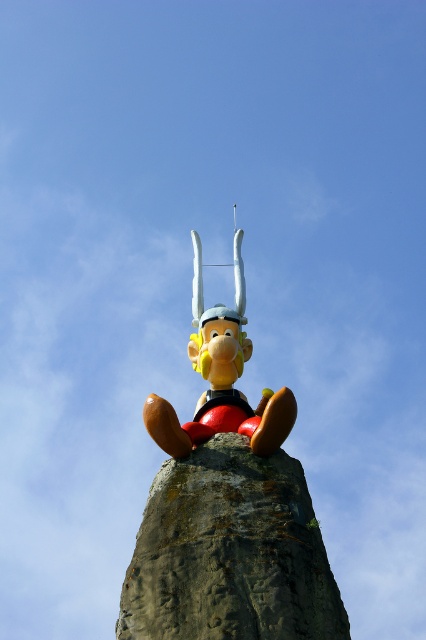
You are an art curator examining two statues in a museum display. The statues are labeled as the matte plastic statue at center and the shiny plastic statue at center. Based on their positions, which statue is positioned to the right side of the other?

The matte plastic statue at center is positioned to the right of the shiny plastic statue at center according to the description.

You are a photographer planning to take a photo of the matte plastic statue at center and the rusty stone monument at center. Since the statue is above the monument, where should you position yourself to capture both in the frame?

You should position yourself at a lower angle to capture both the matte plastic statue at center and the rusty stone monument at center in the frame since the statue is located above the monument.

You are a photographer planning to take a picture of the statue. You want to ensure the statue is the main focus of your photo. Which object at point (227, 508) should you focus on?

You should focus on the matte plastic statue at center located at point (227, 508) to ensure it is the main focus of your photo.